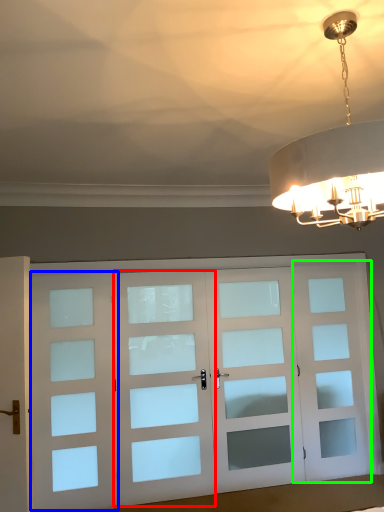
Question: Estimate the real-world distances between objects in this image. Which object is closer to screen door (highlighted by a red box), screen door (highlighted by a blue box) or screen door (highlighted by a green box)?

Choices:
 (A) screen door
 (B) screen door

Answer: (A)